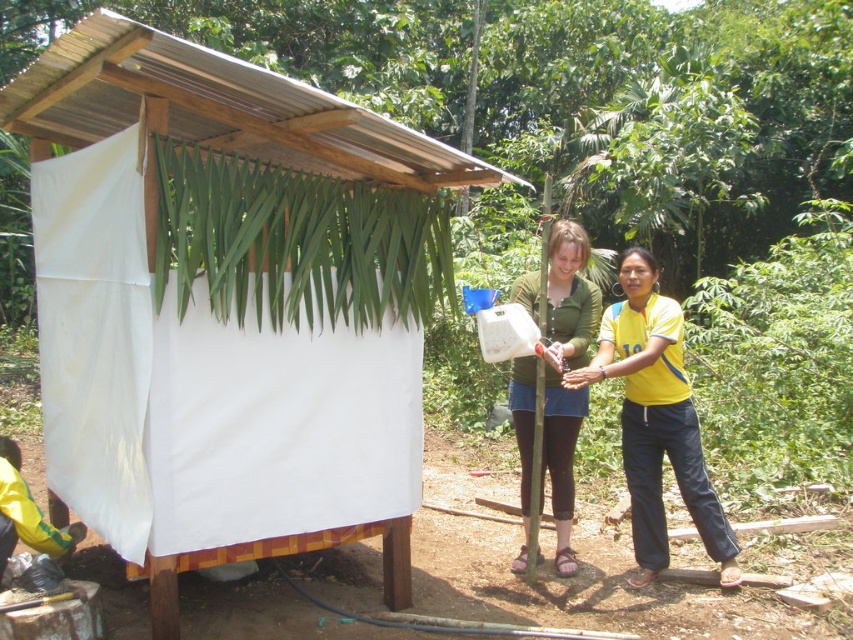
Who is more forward, (492, 182) or (590, 288)?

Positioned in front is point (492, 182).

Is white fabric shelter at center thinner than green matte shirt at center?

No.

I want to click on white fabric shelter at center, so click(x=228, y=301).

Between white fabric shelter at center and yellow fabric pants at center, which one appears on the left side from the viewer's perspective?

From the viewer's perspective, white fabric shelter at center appears more on the left side.

Is white fabric shelter at center positioned at the back of yellow fabric pants at center?

No, it is in front of yellow fabric pants at center.

Which is in front, point (444, 240) or point (676, 385)?

Point (444, 240) is in front.

Where is `white fabric shelter at center`? This screenshot has height=640, width=853. white fabric shelter at center is located at coordinates (228, 301).

Who is more distant from viewer, (641, 387) or (582, 264)?

Positioned behind is point (582, 264).

Is yellow fabric pants at center to the right of green matte shirt at center from the viewer's perspective?

Correct, you'll find yellow fabric pants at center to the right of green matte shirt at center.

Is point (689, 448) less distant than point (509, 392)?

That is True.

Locate an element on the screen. yellow fabric pants at center is located at coordinates (656, 419).